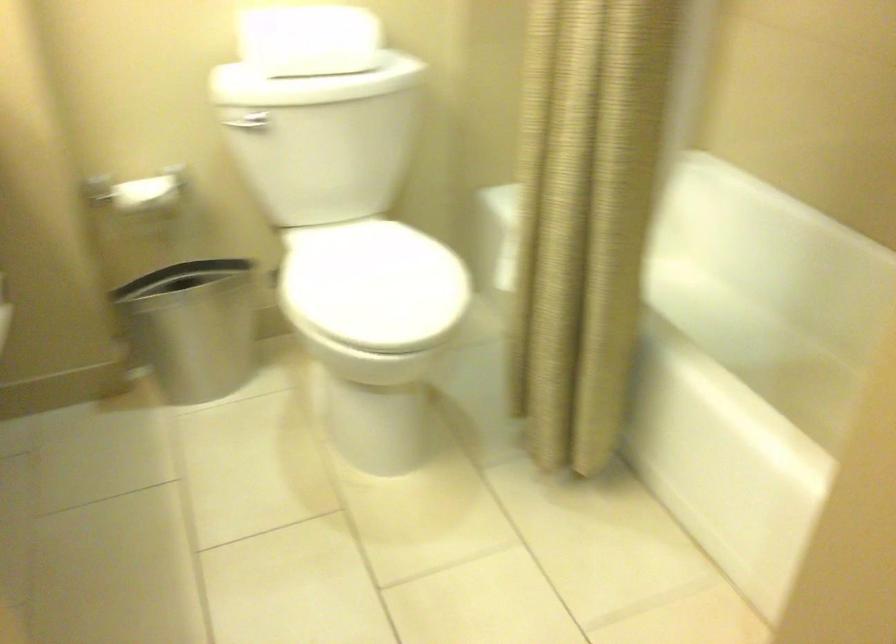
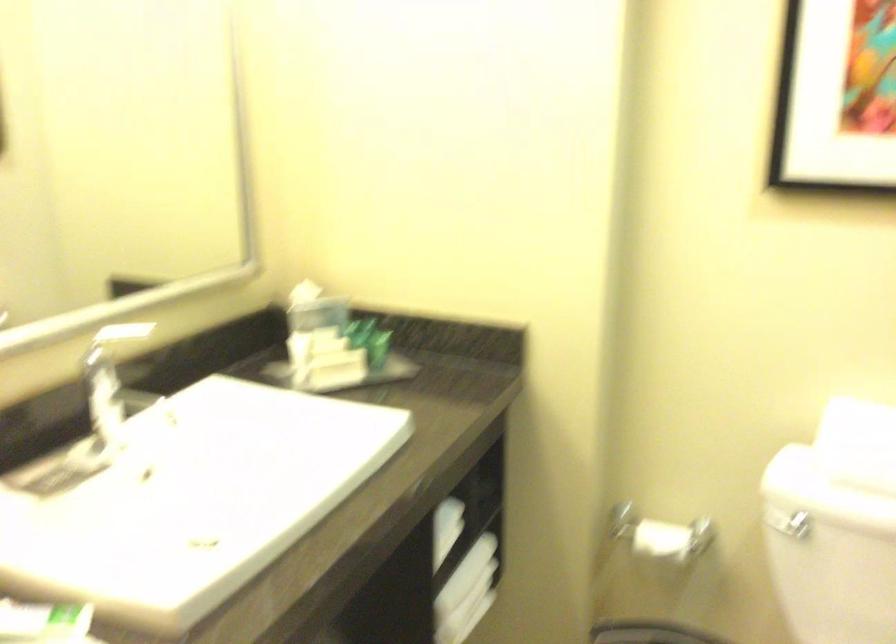
Locate, in the second image, the point that corresponds to the point at 250,125 in the first image.

(788, 524)